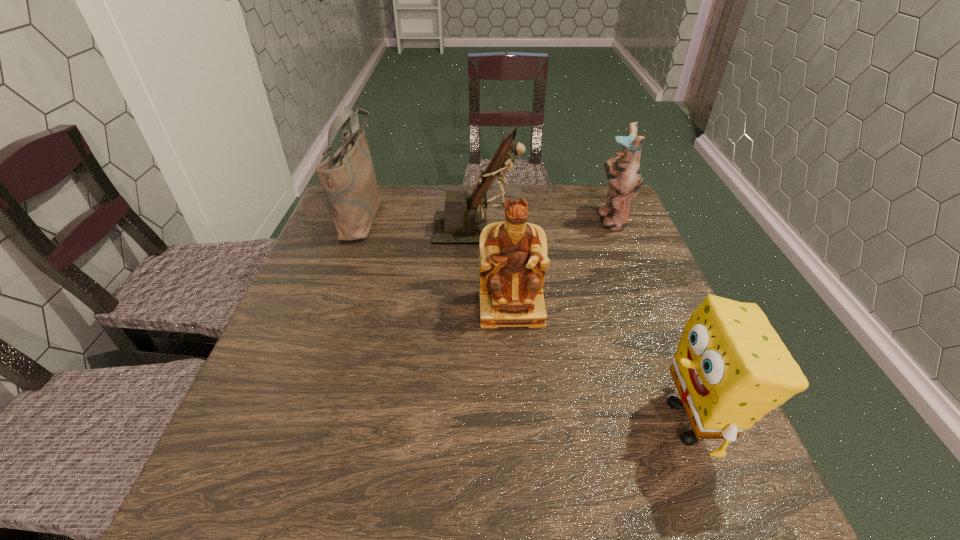
Locate an element on the screen. This screenshot has height=540, width=960. free spot at the left edge of the desktop is located at coordinates (354, 249).

You are a GUI agent. You are given a task and a screenshot of the screen. Output one action in this format:
    pyautogui.click(x=<x>, y=<y>)
    Task: Click on the vacant space at the right edge of the desktop
    
    Given the screenshot: What is the action you would take?
    pyautogui.click(x=626, y=228)

This screenshot has width=960, height=540. Find the location of `free spot at the far right corner of the desktop`. free spot at the far right corner of the desktop is located at coordinates [x=605, y=205].

The image size is (960, 540). What are the coordinates of `unoccupied area between the nearest figurine and the nearest object` in the screenshot? It's located at click(x=601, y=365).

At what (x,y) coordinates should I click in order to perform the action: click on vacant area that lies between the rightmost figurine and the nearest object. Please return your answer as a coordinate pair (x, y). The width and height of the screenshot is (960, 540). Looking at the image, I should click on (652, 321).

Locate an element on the screen. free space between the nearest figurine and the rightmost figurine is located at coordinates (562, 264).

At what (x,y) coordinates should I click in order to perform the action: click on object that is the third closest to the nearest figurine. Please return your answer as a coordinate pair (x, y). This screenshot has width=960, height=540. Looking at the image, I should click on (623, 172).

Where is `object that is the fourth closest to the nearest object`? Image resolution: width=960 pixels, height=540 pixels. object that is the fourth closest to the nearest object is located at coordinates tap(347, 178).

Locate an element on the screen. figurine object that ranks as the second closest to the rightmost figurine is located at coordinates (513, 259).

Identify which figurine is the nearest to the leftmost object. Please provide its 2D coordinates. Your answer should be formatted as a tuple, i.e. [(x, y)], where the tuple contains the x and y coordinates of a point satisfying the conditions above.

[(460, 223)]